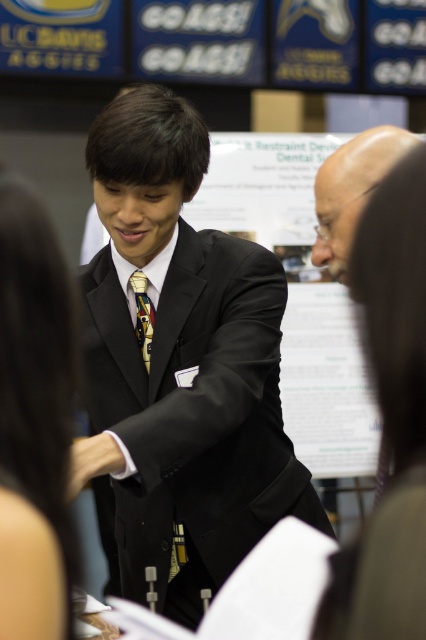
Question: Which object is closer to the camera taking this photo?

Choices:
 (A) smooth brown hair at upper right
 (B) bald head at upper right
 (C) yellow silk tie at center

Answer: (A)

Question: Which point is farther to the camera?

Choices:
 (A) black matte suit at center
 (B) bald head at upper right
 (C) smooth brown hair at upper right
 (D) smooth black hair at center

Answer: (A)

Question: Can you confirm if smooth black hair at center is smaller than yellow silk tie at center?

Choices:
 (A) no
 (B) yes

Answer: (A)

Question: Which of the following is the closest to the observer?

Choices:
 (A) black matte suit at center
 (B) smooth black hair at center
 (C) bald head at upper right

Answer: (B)

Question: Can you confirm if smooth brown hair at upper right is wider than bald head at upper right?

Choices:
 (A) no
 (B) yes

Answer: (A)

Question: Can you confirm if black matte suit at center is wider than bald head at upper right?

Choices:
 (A) yes
 (B) no

Answer: (A)